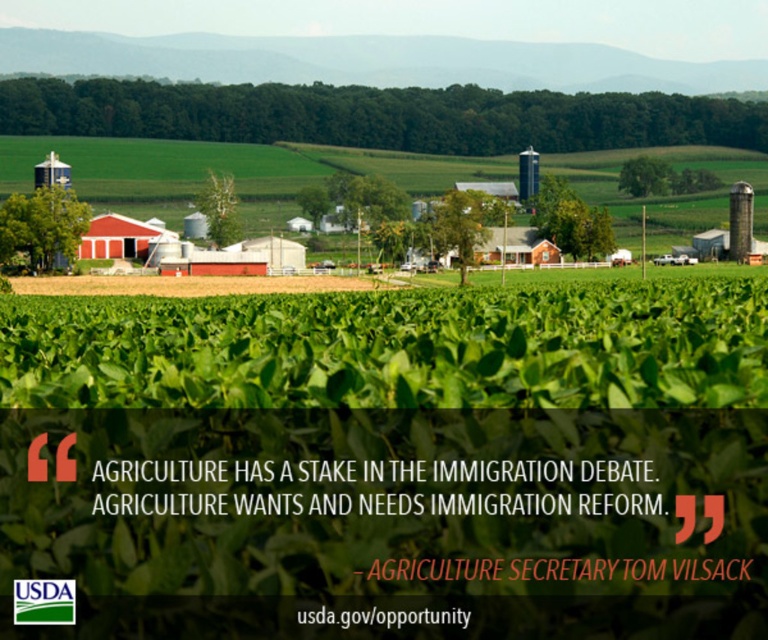
Question: Is matte red barn at center-left closer to camera compared to matte red barn at center?

Choices:
 (A) yes
 (B) no

Answer: (B)

Question: Among these objects, which one is farthest from the camera?

Choices:
 (A) matte red barn at center
 (B) gray concrete silo at right
 (C) metallic silver silo at center
 (D) matte red barn at center-left

Answer: (C)

Question: Can you confirm if matte red barn at center-left is bigger than matte red barn at center?

Choices:
 (A) no
 (B) yes

Answer: (A)

Question: Among these objects, which one is farthest from the camera?

Choices:
 (A) red corrugated metal barn at center
 (B) metallic silver silo at center
 (C) matte red barn at center

Answer: (B)

Question: Is matte red barn at center-left smaller than gray concrete silo at right?

Choices:
 (A) yes
 (B) no

Answer: (B)

Question: Estimate the real-world distances between objects in this image. Which object is farther from the metallic silver silo at center?

Choices:
 (A) red corrugated metal barn at center
 (B) matte red barn at center

Answer: (A)